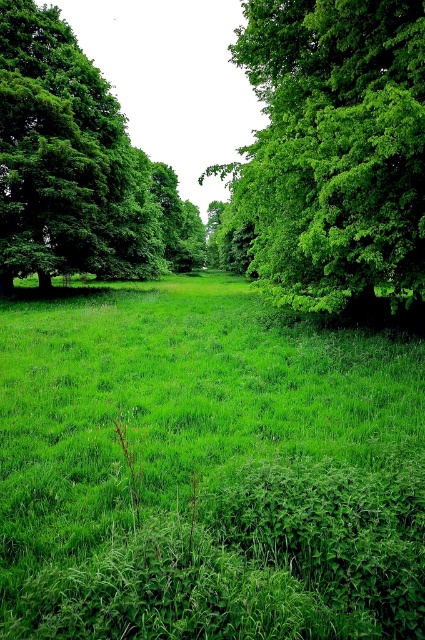
You are standing in a lush green landscape with a green leafy tree at center. If you want to reach the tree within 10 seconds, what is the minimum speed you need to walk at?

The green leafy tree at center is 7.77 meters away. To cover 7.77 meters in 10 seconds, you need to walk at a minimum speed of 0.777 meters per second.

You are a gardener who wants to plant a new flower bed. You have two options for locations in the scene shown. One is near the green grassy at center, and the other is near the green leafy tree at center. Which location would provide more sunlight for the flowers?

The green grassy at center has a lesser height compared to the green leafy tree at center. Therefore, planting near the green grassy at center would provide more sunlight for the flowers since it is shorter and less likely to block sunlight.

You are a hiker standing in the middle of the landscape. You want to find the tallest tree to take a photo. Which tree should you choose between the green leafy tree at center and the green leafy tree at left?

The green leafy tree at left is taller than the green leafy tree at center, so you should choose the green leafy tree at left to take a photo.